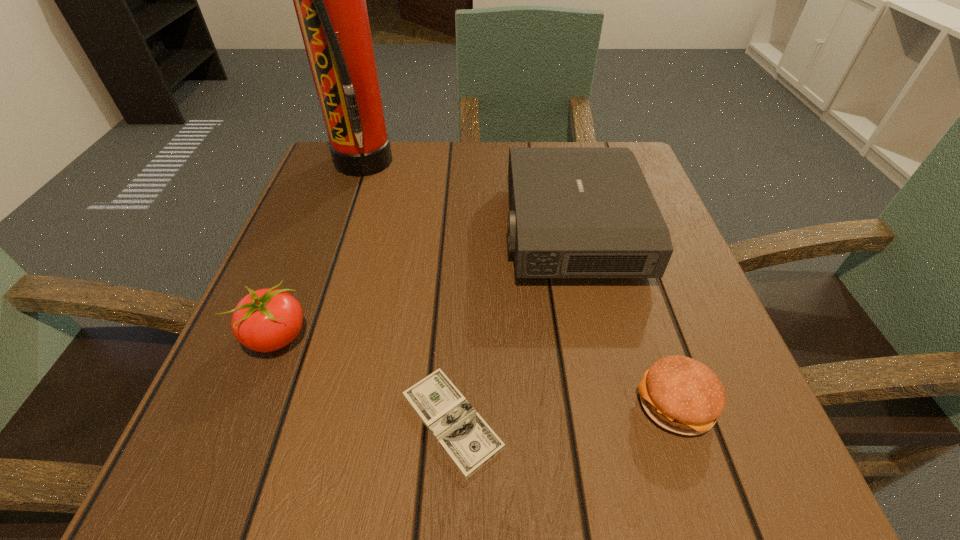
Where is `hamburger that is at the right edge`? The height and width of the screenshot is (540, 960). hamburger that is at the right edge is located at coordinates (680, 394).

The width and height of the screenshot is (960, 540). I want to click on object present at the far left corner, so click(330, 0).

Identify the location of object that is at the far right corner. (575, 212).

Where is `object positioned at the near right corner`? The height and width of the screenshot is (540, 960). object positioned at the near right corner is located at coordinates click(x=680, y=394).

Locate an element on the screen. This screenshot has height=540, width=960. vacant area at the far edge of the desktop is located at coordinates (425, 166).

In order to click on vacant area at the near edge in this screenshot , I will do `click(401, 429)`.

Identify the location of free region at the left edge of the desktop. (290, 252).

Locate an element on the screen. vacant region at the right edge of the desktop is located at coordinates (729, 402).

Identify the location of vacant space at the near left corner of the desktop. (197, 462).

Locate an element on the screen. The image size is (960, 540). blank space at the near right corner is located at coordinates (671, 476).